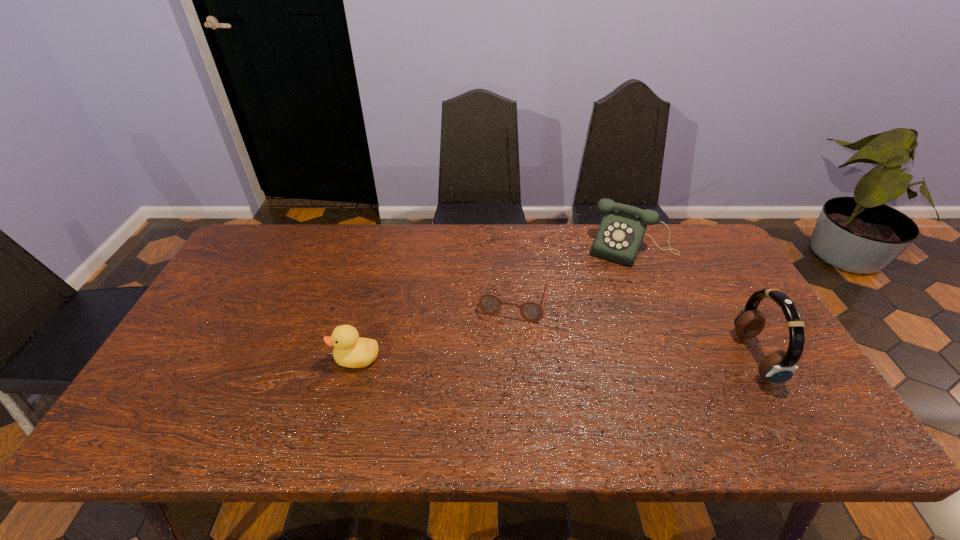
Find the location of `object identified as the closest to the duckling`. object identified as the closest to the duckling is located at coordinates (532, 311).

Locate an element on the screen. free location that satisfies the following two spatial constraints: 1. on the front side of the headset; 2. on the ear cup of the spectacles is located at coordinates (520, 356).

This screenshot has width=960, height=540. What are the coordinates of `vacant space that satisfies the following two spatial constraints: 1. on the front side of the tallest object; 2. on the ear cup of the farthest object` in the screenshot? It's located at (677, 356).

You are a GUI agent. You are given a task and a screenshot of the screen. Output one action in this format:
    pyautogui.click(x=<x>, y=<y>)
    Task: Click on the vacant space that satisfies the following two spatial constraints: 1. on the front side of the spectacles; 2. on the ear cup of the headset
    
    Given the screenshot: What is the action you would take?
    pyautogui.click(x=520, y=356)

Find the location of a particular element. vacant space that satisfies the following two spatial constraints: 1. on the front side of the rightmost object; 2. on the ear cup of the shortest object is located at coordinates (x=520, y=356).